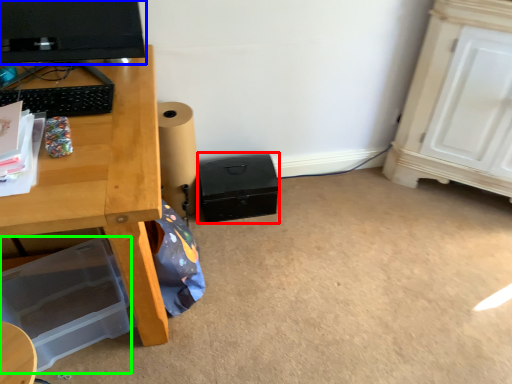
Question: Which object is the farthest from box (highlighted by a red box)? Choose among these: computer monitor (highlighted by a blue box) or box (highlighted by a green box).

Choices:
 (A) computer monitor
 (B) box

Answer: (A)